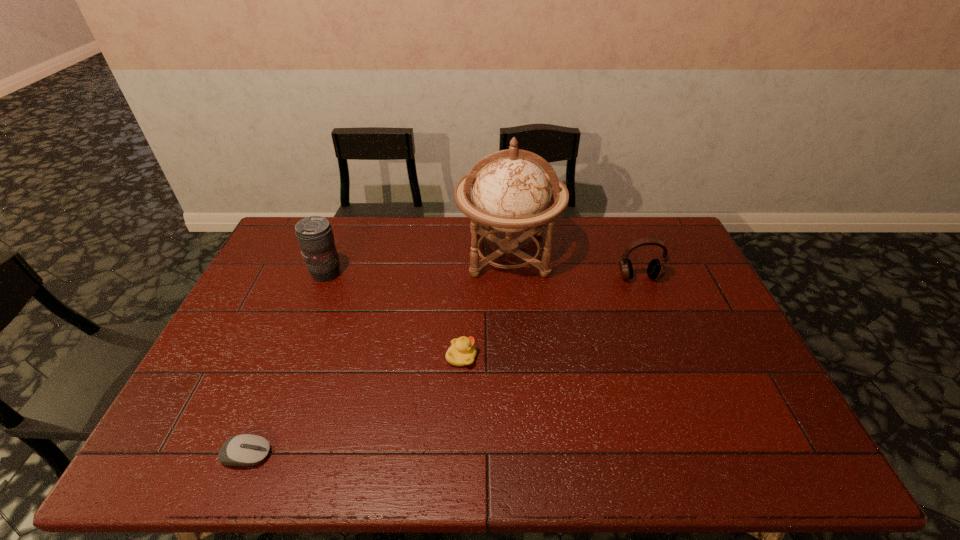
Where is `free spot between the rightmost object and the globe`? free spot between the rightmost object and the globe is located at coordinates (573, 266).

The width and height of the screenshot is (960, 540). I want to click on empty location between the second shortest object and the globe, so click(x=485, y=305).

Find the location of a particular element. Image resolution: width=960 pixels, height=540 pixels. object that can be found as the closest to the globe is located at coordinates (656, 269).

Locate which object ranks fourth in proximity to the third tallest object. Please provide its 2D coordinates. Your answer should be formatted as a tuple, i.e. [(x, y)], where the tuple contains the x and y coordinates of a point satisfying the conditions above.

[(245, 449)]

The height and width of the screenshot is (540, 960). I want to click on vacant space that satisfies the following two spatial constraints: 1. at the front of the tallest object showing Africa; 2. on the wheel side of the shortest object, so click(x=523, y=455).

At what (x,y) coordinates should I click in order to perform the action: click on vacant region that satisfies the following two spatial constraints: 1. on the ear pads of the rightmost object; 2. on the beak of the fourth tallest object. Please return your answer as a coordinate pair (x, y). This screenshot has width=960, height=540. Looking at the image, I should click on (670, 357).

The height and width of the screenshot is (540, 960). In order to click on vacant space that satisfies the following two spatial constraints: 1. at the front of the tallest object showing Africa; 2. on the wheel side of the computer equipment in this screenshot , I will do `click(523, 455)`.

This screenshot has height=540, width=960. I want to click on free space that satisfies the following two spatial constraints: 1. on the ear pads of the headset; 2. on the wheel side of the computer equipment, so click(x=709, y=455).